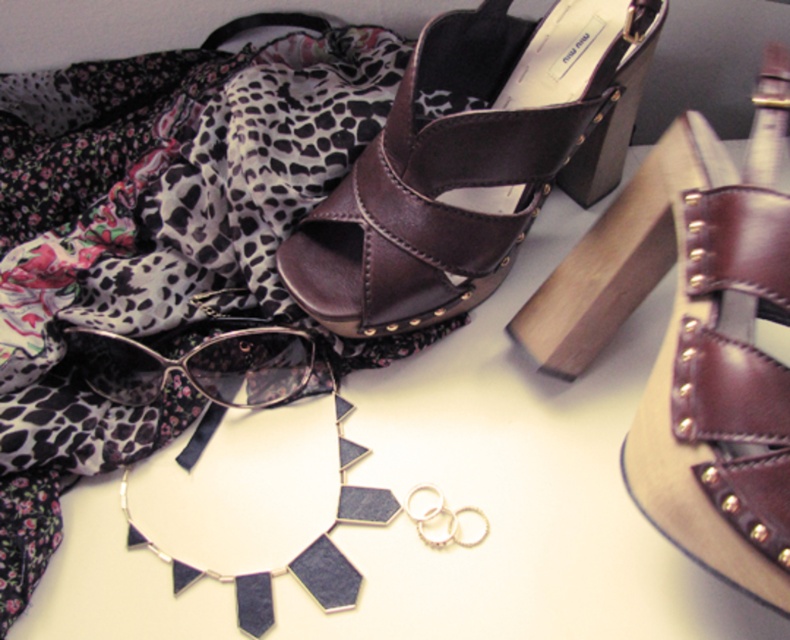
Question: Which point is closer to the camera?

Choices:
 (A) brown leather sandal at center
 (B) matte black sunglasses at center

Answer: (A)

Question: Can you confirm if brown leather sandal at center is bigger than matte black sunglasses at center?

Choices:
 (A) no
 (B) yes

Answer: (B)

Question: Does brown leather sandal at center appear under matte black sunglasses at center?

Choices:
 (A) no
 (B) yes

Answer: (A)

Question: Is brown leather sandal at center wider than matte black sunglasses at center?

Choices:
 (A) no
 (B) yes

Answer: (B)